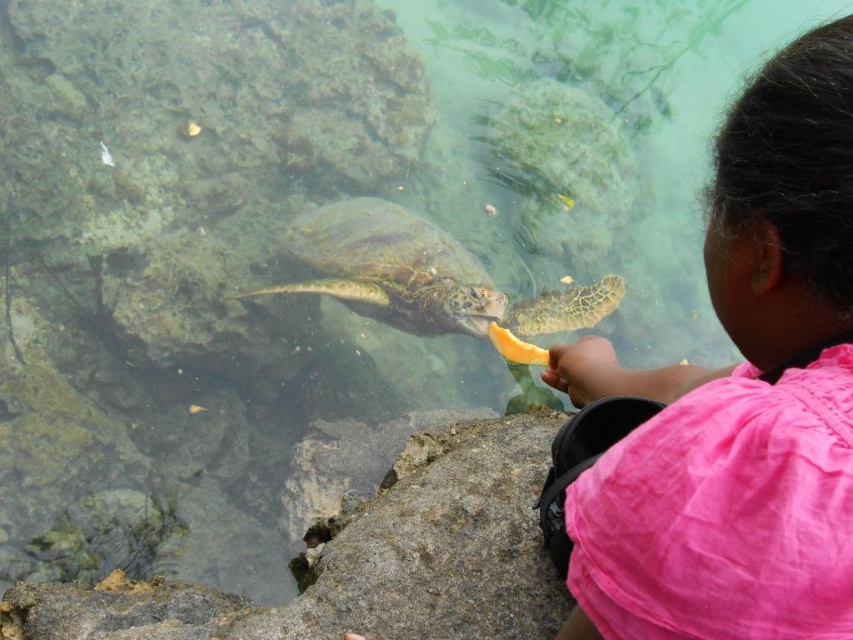
Looking at this image, you are a marine biologist observing the scene. You need to determine the relative height of the pink fabric shirt at upper right and the green textured shell at center. Which object is taller?

The pink fabric shirt at upper right is not as tall as the green textured shell at center, so the green textured shell at center is taller.

You are a marine biologist observing the scene. You notice the pink fabric shirt at upper right and the green textured shell at center. Based on their positions, which object is closer to the water surface?

The green textured shell at center is closer to the water surface because the pink fabric shirt at upper right is located below it.